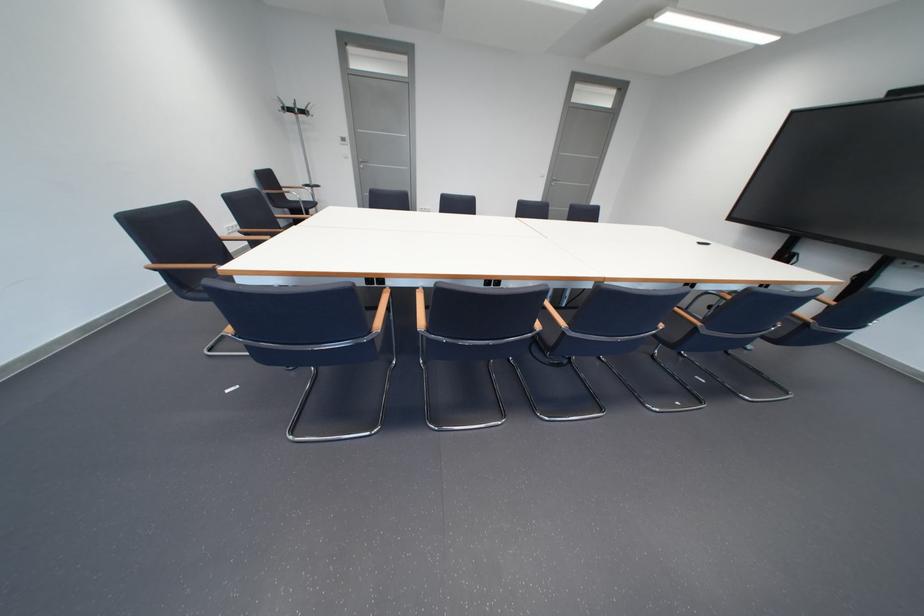
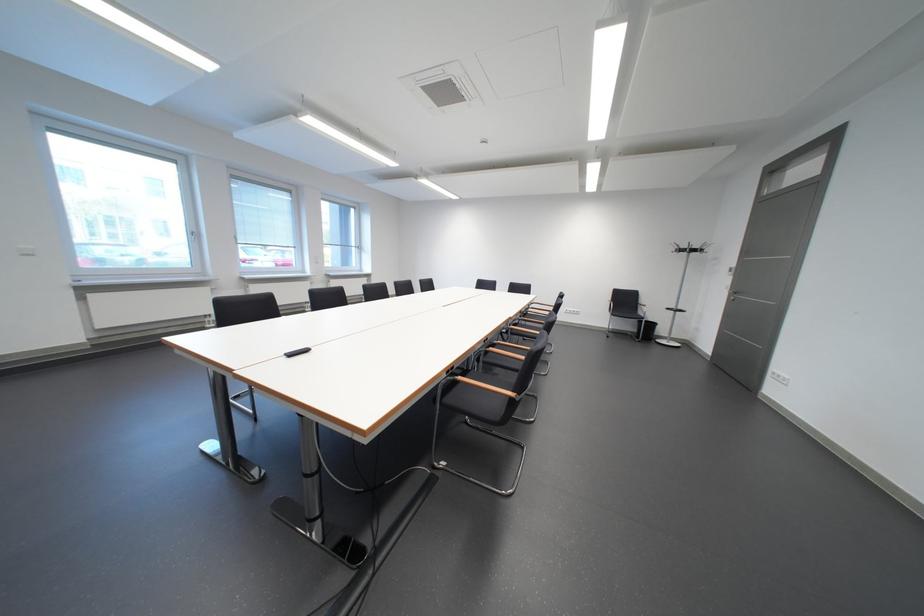
Question: I am providing you with two images of the same scene from different viewpoints. Please identify which objects are invisible in image2.

Choices:
 (A) wooden chair armrest
 (B) window handle
 (C) white cylinder cup
 (D) black remote control

Answer: (A)